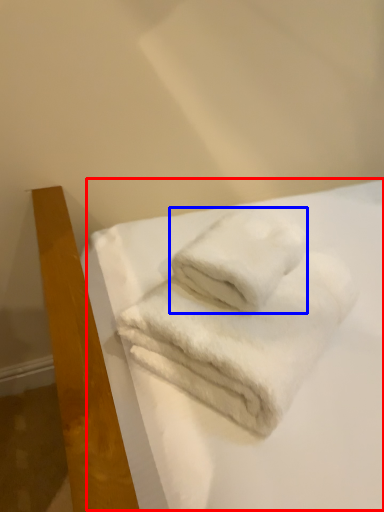
Question: Which object is further to the camera taking this photo, sheet (highlighted by a red box) or towel (highlighted by a blue box)?

Choices:
 (A) sheet
 (B) towel

Answer: (B)